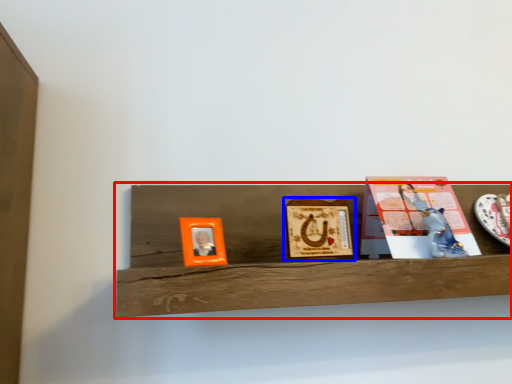
Question: Which of the following is the closest to the observer, shelf (highlighted by a red box) or picture frame (highlighted by a blue box)?

Choices:
 (A) shelf
 (B) picture frame

Answer: (A)